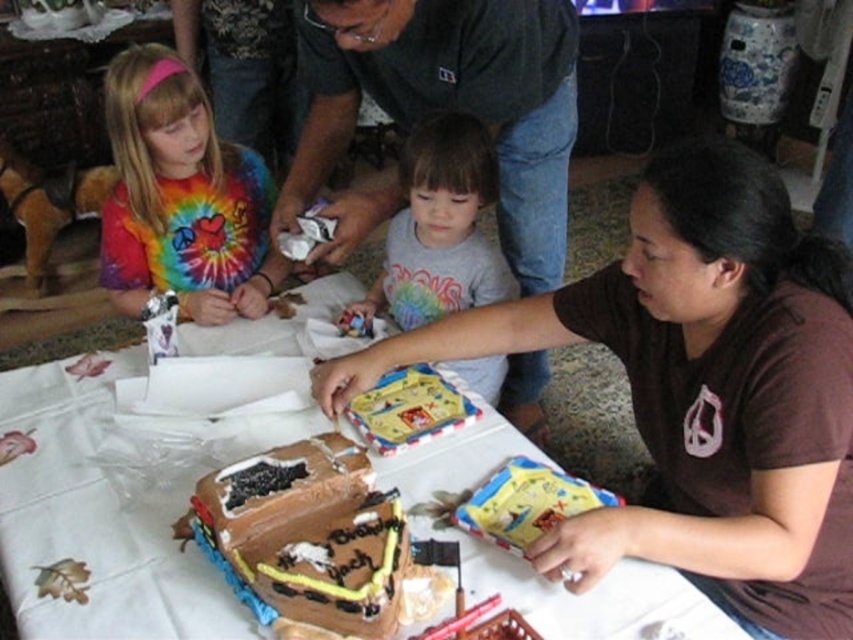
Question: Considering the relative positions of tie-dye fabric shirt at upper left and rainbow tie-dye shirt at center in the image provided, where is tie-dye fabric shirt at upper left located with respect to rainbow tie-dye shirt at center?

Choices:
 (A) right
 (B) left

Answer: (B)

Question: Considering the real-world distances, which object is closest to the dark gray shirt at center?

Choices:
 (A) white paper table at center
 (B) brown matte shirt at center

Answer: (A)

Question: Estimate the real-world distances between objects in this image. Which object is closer to the white paper table at center?

Choices:
 (A) chocolate fondant cake at center
 (B) rainbow tie-dye shirt at center
 (C) tie-dye fabric shirt at upper left

Answer: (A)

Question: Can you confirm if dark gray shirt at center is positioned below rainbow tie-dye shirt at center?

Choices:
 (A) yes
 (B) no

Answer: (B)

Question: Considering the real-world distances, which object is farthest from the chocolate fondant cake at center?

Choices:
 (A) rainbow tie-dye shirt at center
 (B) tie-dye fabric shirt at upper left
 (C) dark gray shirt at center

Answer: (B)

Question: Considering the relative positions of white paper table at center and dark gray shirt at center in the image provided, where is white paper table at center located with respect to dark gray shirt at center?

Choices:
 (A) above
 (B) below

Answer: (B)